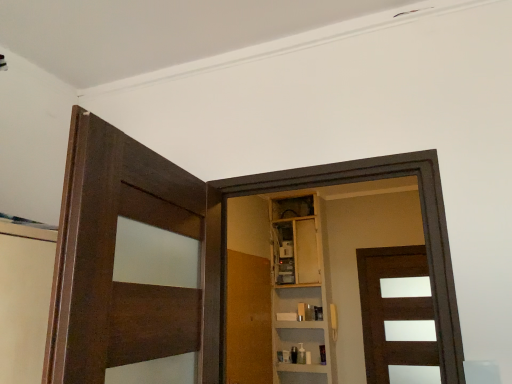
Question: Is dark wood door at left, placed as the third door when sorted from right to left, thinner than brown matte door at center, which appears as the 1th door when viewed from the back?

Choices:
 (A) yes
 (B) no

Answer: (B)

Question: Can brown matte door at center, the 3th door viewed from the left, be found inside dark wood door at left, arranged as the first door when viewed from the front?

Choices:
 (A) no
 (B) yes

Answer: (A)

Question: From a real-world perspective, does dark wood door at left, arranged as the first door when viewed from the front, stand above brown matte door at center, acting as the third door starting from the front?

Choices:
 (A) yes
 (B) no

Answer: (A)

Question: Does dark wood door at left, the first door viewed from the left, have a larger size compared to brown matte door at center, which appears as the 1th door when viewed from the back?

Choices:
 (A) yes
 (B) no

Answer: (B)

Question: Considering the relative sizes of dark wood door at left, which is the 3th door from back to front, and brown matte door at center, the 3th door viewed from the left, in the image provided, is dark wood door at left, which is the 3th door from back to front, wider than brown matte door at center, the 3th door viewed from the left,?

Choices:
 (A) yes
 (B) no

Answer: (A)

Question: Looking at their shapes, would you say wooden cabinet at center is wider or thinner than brown matte door at center, the 3th door viewed from the left?

Choices:
 (A) wide
 (B) thin

Answer: (A)

Question: Would you say wooden cabinet at center is to the left or to the right of brown matte door at center, which appears as the 1th door when viewed from the back, in the picture?

Choices:
 (A) right
 (B) left

Answer: (B)

Question: Considering their positions, is wooden cabinet at center located in front of or behind brown matte door at center, the 3th door viewed from the left?

Choices:
 (A) front
 (B) behind

Answer: (B)

Question: Does point (303, 236) appear closer or farther from the camera than point (375, 374)?

Choices:
 (A) farther
 (B) closer

Answer: (A)

Question: In the image, is wooden door at center, marked as the 2th door in a left-to-right arrangement, positioned in front of or behind wooden cabinet at center?

Choices:
 (A) behind
 (B) front

Answer: (B)

Question: Considering the positions of wooden door at center, marked as the 2th door in a left-to-right arrangement, and wooden cabinet at center in the image, is wooden door at center, marked as the 2th door in a left-to-right arrangement, bigger or smaller than wooden cabinet at center?

Choices:
 (A) big
 (B) small

Answer: (B)

Question: Looking at their shapes, would you say wooden door at center, the 2th door when ordered from front to back, is wider or thinner than wooden cabinet at center?

Choices:
 (A) wide
 (B) thin

Answer: (B)

Question: From a real-world perspective, relative to wooden cabinet at center, is wooden door at center, the 2th door when ordered from front to back, vertically above or below?

Choices:
 (A) above
 (B) below

Answer: (B)

Question: From the image's perspective, relative to dark wood door at left, arranged as the first door when viewed from the front, is brown matte door at center, the 3th door viewed from the left, above or below?

Choices:
 (A) below
 (B) above

Answer: (A)

Question: Is brown matte door at center, the 1th door positioned from the right, to the left or to the right of dark wood door at left, placed as the third door when sorted from right to left, in the image?

Choices:
 (A) left
 (B) right

Answer: (B)